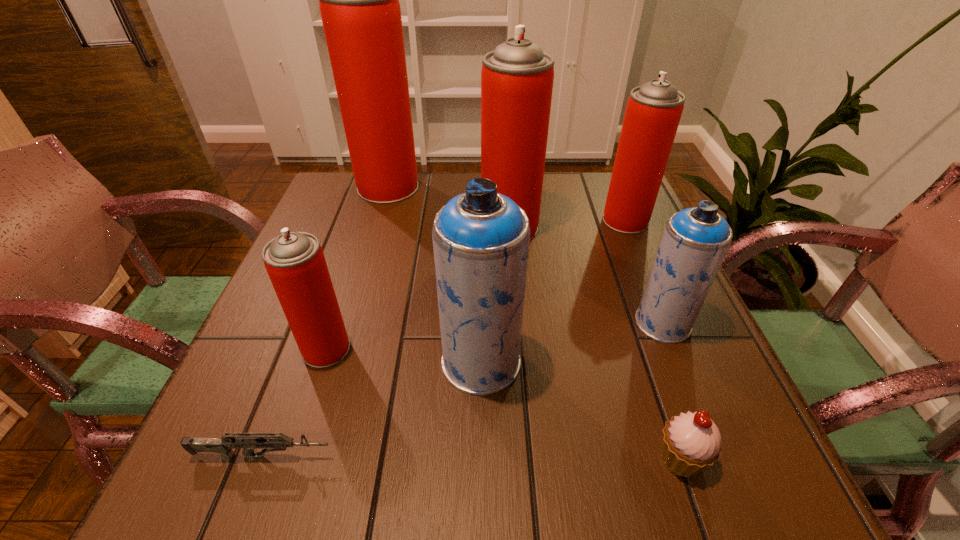
In the image, there is a desktop. At what (x,y) coordinates should I click in order to perform the action: click on free space at the far left corner. Please return your answer as a coordinate pair (x, y). Looking at the image, I should click on (347, 217).

This screenshot has width=960, height=540. I want to click on vacant space at the far right corner, so click(599, 185).

Image resolution: width=960 pixels, height=540 pixels. I want to click on vacant point located between the rightmost red aerosol can and the smaller blue aerosol can, so click(x=644, y=272).

Identify the location of free space between the left blue aerosol can and the cupcake. The height and width of the screenshot is (540, 960). pos(581,410).

Image resolution: width=960 pixels, height=540 pixels. Find the location of `vacant space in between the bigger blue aerosol can and the gun`. vacant space in between the bigger blue aerosol can and the gun is located at coordinates (372, 409).

Where is `blank region between the third red aerosol can from left to right and the nearest red aerosol can`? blank region between the third red aerosol can from left to right and the nearest red aerosol can is located at coordinates (418, 288).

Locate an element on the screen. vacant area that lies between the farthest red aerosol can and the smallest red aerosol can is located at coordinates (357, 268).

The image size is (960, 540). In order to click on vacant area that lies between the second shortest object and the bigger blue aerosol can in this screenshot , I will do `click(581, 410)`.

Find the location of a particular element. This screenshot has height=540, width=960. vacant area that lies between the left blue aerosol can and the cupcake is located at coordinates (581, 410).

Locate an element on the screen. This screenshot has width=960, height=540. vacant point located between the right blue aerosol can and the rightmost red aerosol can is located at coordinates (644, 272).